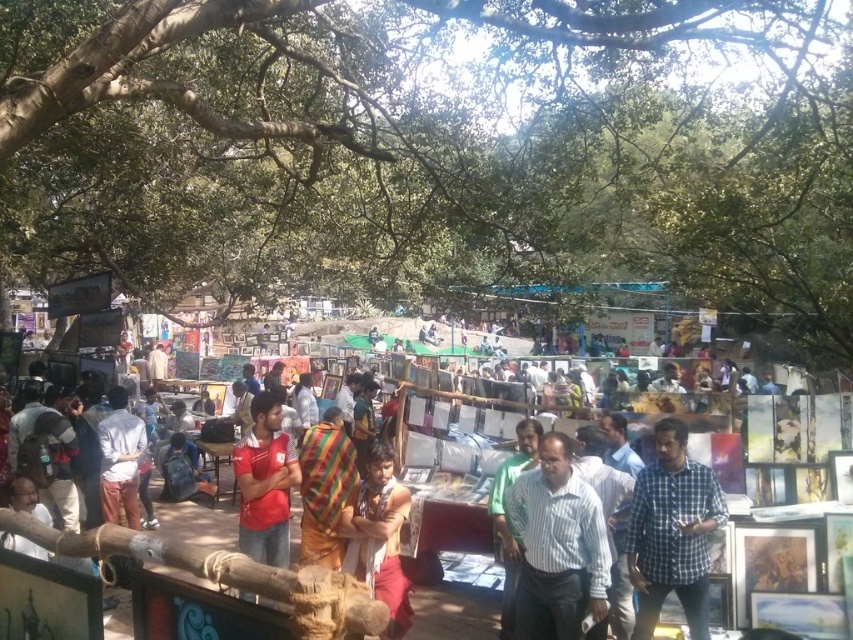
Question: Which of the following is the closest to the observer?

Choices:
 (A) (253, 465)
 (B) (698, 524)

Answer: (B)

Question: Is striped cotton shirt at center above white cotton shirt at center?

Choices:
 (A) yes
 (B) no

Answer: (A)

Question: Can you confirm if red cotton shirt at center is thinner than white cotton shirt at center?

Choices:
 (A) yes
 (B) no

Answer: (B)

Question: Which point appears closest to the camera in this image?

Choices:
 (A) 709,468
 (B) 403,499
 (C) 529,588
 (D) 422,548

Answer: (C)

Question: Considering the real-world distances, which object is farthest from the checkered fabric shirt at center?

Choices:
 (A) green leafy tree at upper center
 (B) white cotton shirt at center
 (C) multicolored woven cloth at center

Answer: (A)

Question: Is checkered fabric shirt at center positioned at the back of red cotton shirt at center?

Choices:
 (A) yes
 (B) no

Answer: (B)